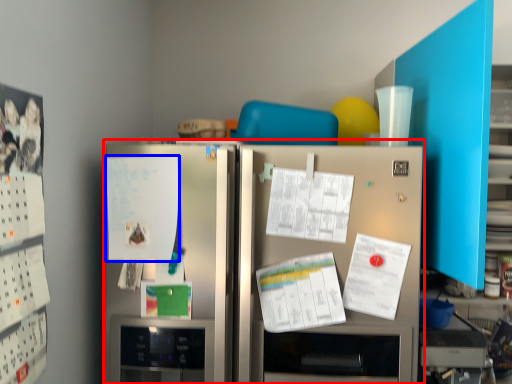
Question: Which point is closer to the camera, refrigerator (highlighted by a red box) or poster (highlighted by a blue box)?

Choices:
 (A) refrigerator
 (B) poster

Answer: (A)